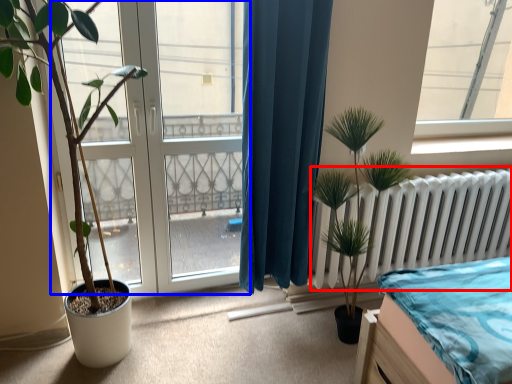
Question: Among these objects, which one is farthest to the camera, radiator (highlighted by a red box) or bay window (highlighted by a blue box)?

Choices:
 (A) radiator
 (B) bay window

Answer: (A)